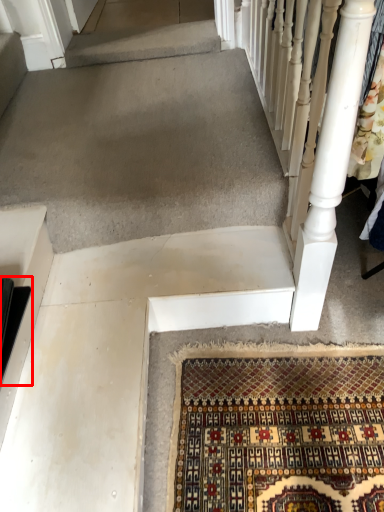
Question: From the image's perspective, where is stairs (annotated by the red box) located in relation to rail in the image?

Choices:
 (A) above
 (B) below

Answer: (B)